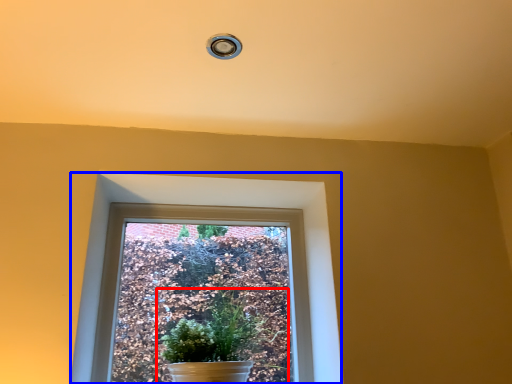
Question: Which of the following is the farthest to the observer, houseplant (highlighted by a red box) or window (highlighted by a blue box)?

Choices:
 (A) houseplant
 (B) window

Answer: (B)